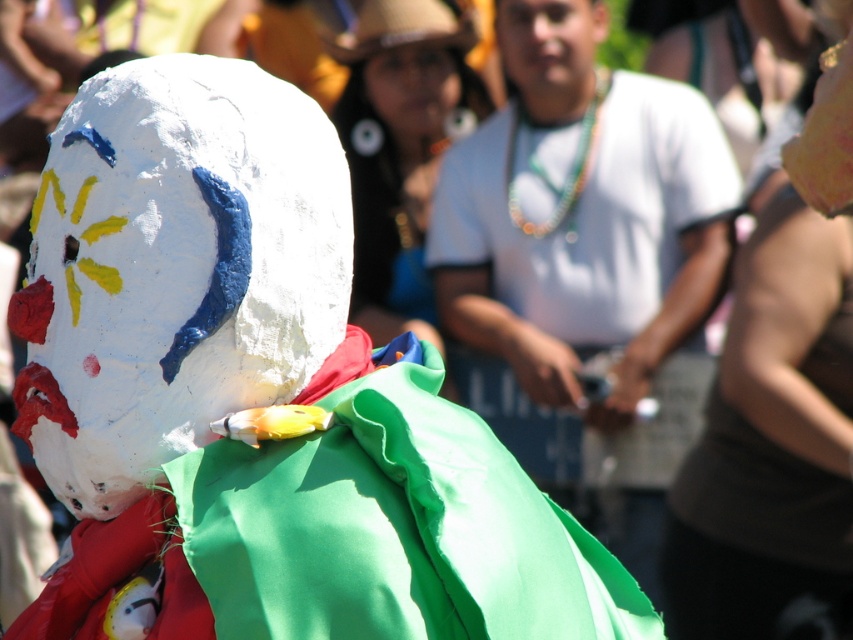
Question: In this image, where is white matte shirt at center located relative to smooth skin face at upper center?

Choices:
 (A) below
 (B) above

Answer: (A)

Question: Which point is farther from the camera taking this photo?

Choices:
 (A) (399, 61)
 (B) (173, 376)
 (C) (631, 412)

Answer: (A)

Question: Can you confirm if matte papier-mâché snowman at center is wider than matte white mask at upper center?

Choices:
 (A) yes
 (B) no

Answer: (A)

Question: Which object is closer to the camera taking this photo?

Choices:
 (A) matte papier-mâché snowman at center
 (B) white matte shirt at center
 (C) white papier-mâché mask at center
 (D) matte white mask at upper center

Answer: (A)

Question: Can you confirm if matte papier-mâché snowman at center is positioned above white matte shirt at center?

Choices:
 (A) no
 (B) yes

Answer: (A)

Question: Which point is farther from the camera taking this photo?

Choices:
 (A) (585, 10)
 (B) (445, 112)
 (C) (590, 136)

Answer: (B)